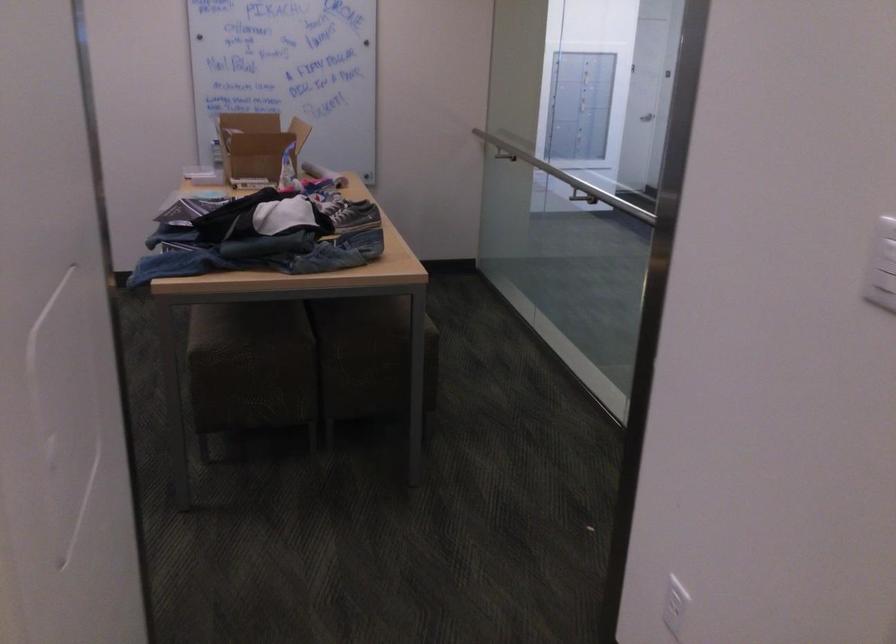
The width and height of the screenshot is (896, 644). Identify the location of white electrical outlet. (675, 605).